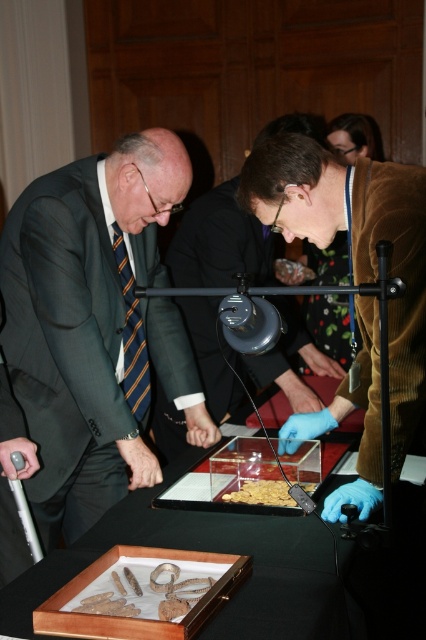
Is point (219, 364) farther from viewer compared to point (284, 483)?

Yes.

Does matte black suit at center appear on the right side of translucent plastic food at center?

Correct, you'll find matte black suit at center to the right of translucent plastic food at center.

Between point (270, 353) and point (250, 484), which one is positioned in front?

Point (250, 484)

Locate an element on the screen. matte black suit at center is located at coordinates (221, 243).

Can you confirm if transparent glass tray at center is wider than striped fabric tie at left?

Correct, the width of transparent glass tray at center exceeds that of striped fabric tie at left.

Between transparent glass tray at center and striped fabric tie at left, which one is positioned lower?

Positioned lower is transparent glass tray at center.

Is point (285, 541) closer to camera compared to point (126, 285)?

Yes, point (285, 541) is closer to viewer.

The height and width of the screenshot is (640, 426). I want to click on transparent glass tray at center, so click(259, 568).

Measure the distance between matte black suit at center and floral fabric dress at center.

A distance of 18.65 inches exists between matte black suit at center and floral fabric dress at center.

This screenshot has width=426, height=640. Find the location of `matte black suit at center`. matte black suit at center is located at coordinates (221, 243).

Identify the location of matte black suit at center. This screenshot has height=640, width=426. (221, 243).